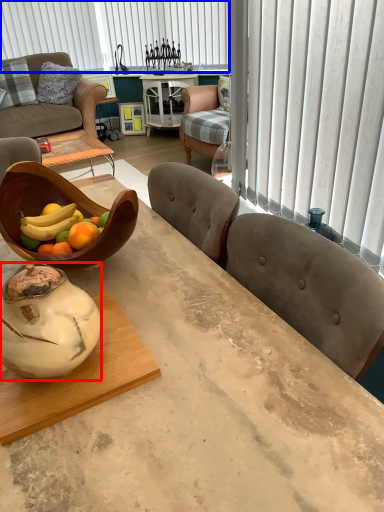
Question: Which of the following is the farthest to the observer, vase (highlighted by a red box) or blind (highlighted by a blue box)?

Choices:
 (A) vase
 (B) blind

Answer: (B)